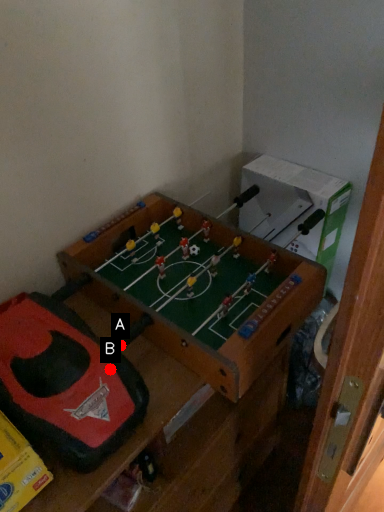
Question: Two points are circled on the image, labeled by A and B beside each circle. Among these points, which one is nearest to the camera?

Choices:
 (A) A is closer
 (B) B is closer

Answer: (B)